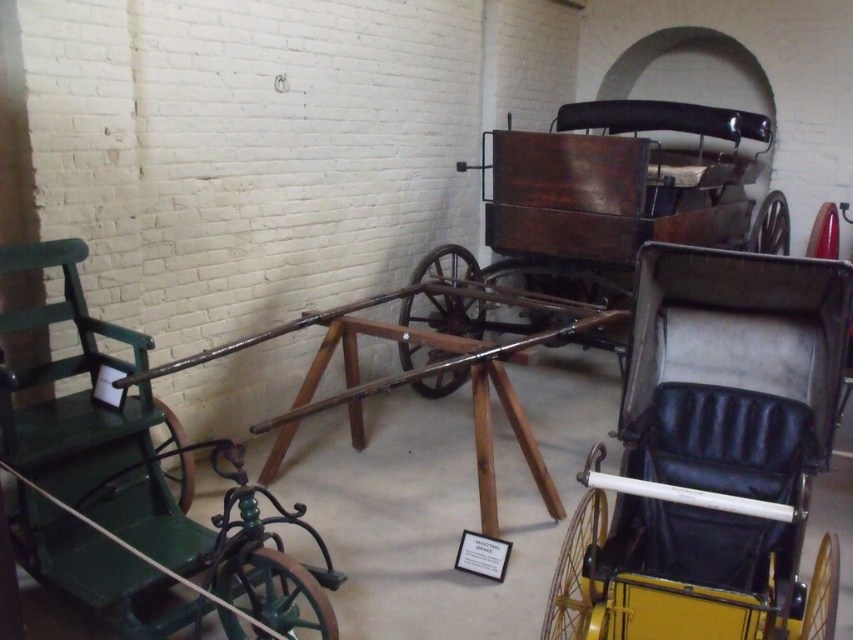
In the scene shown: You are organizing a small event in the space and need to place a rectangular table that is 1.2 meters wide between the yellow leather chair at center and the green wrought iron chair at left. Based on the space between them, will the table fit?

The yellow leather chair at center is narrower than the green wrought iron chair at left, but the distance between them isn